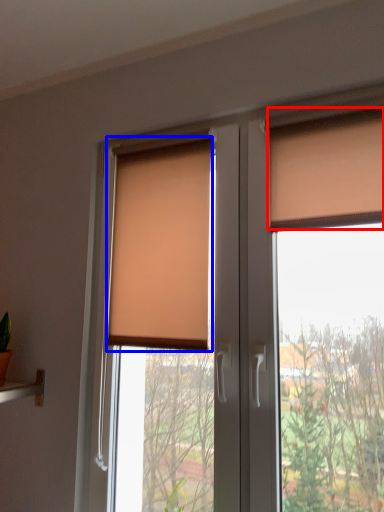
Question: Which object appears farthest to the camera in this image, curtain (highlighted by a red box) or window blind (highlighted by a blue box)?

Choices:
 (A) curtain
 (B) window blind

Answer: (B)